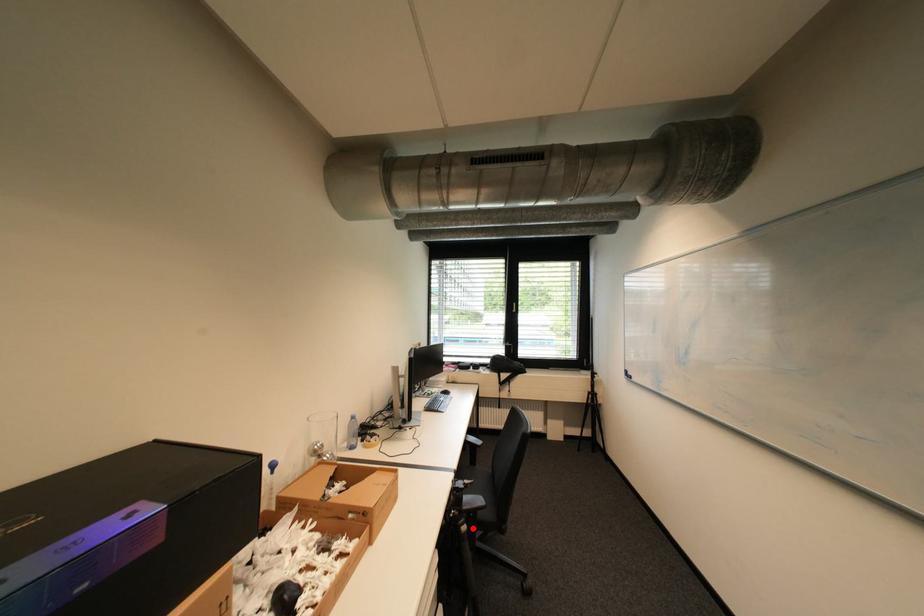
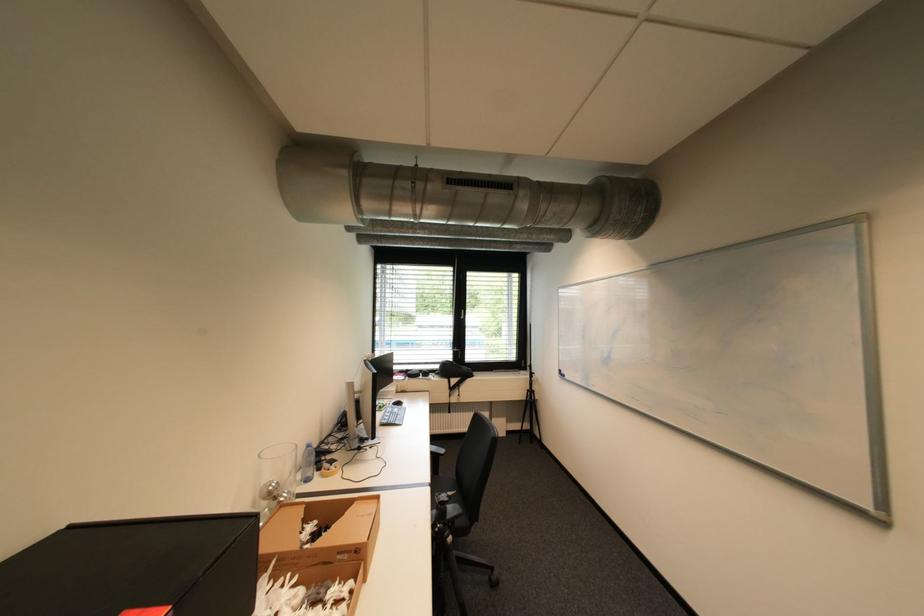
Where in the second image is the point corresponding to the highlighted location from the first image?

(458, 540)